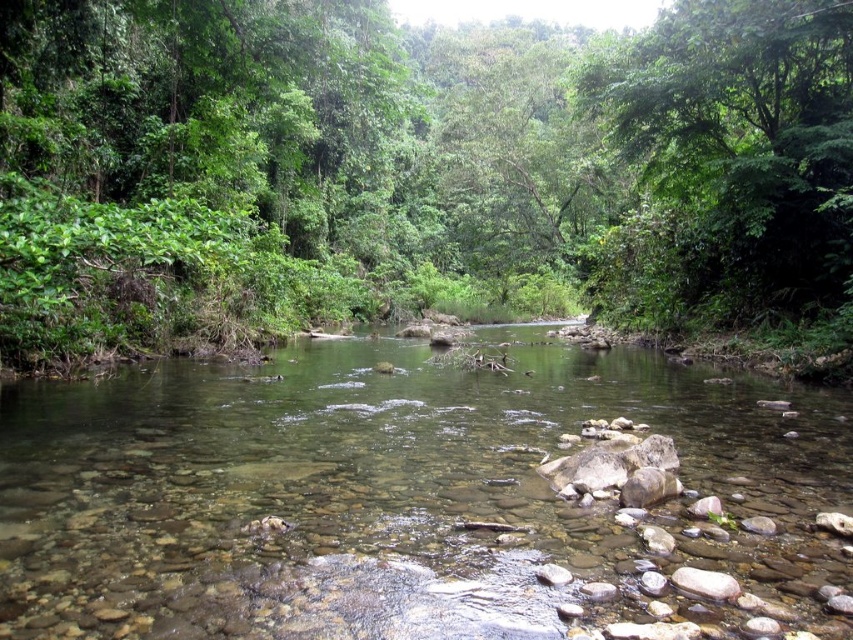
You are standing at the edge of the forest and want to cross the clear stone stream at center. There is a green leafy tree at upper center that you can use as a landmark. Which direction should you walk to reach the stream first before the tree becomes visible?

You should walk towards the clear stone stream at center because it is closer to you than the green leafy tree at upper center, so you will reach the stream before the tree comes into view.

You are standing at the edge of the river and want to determine which green leafy tree is taller. You see the green leafy tree at center and the green leafy tree at upper center. Which one is taller?

The green leafy tree at center is taller than the green leafy tree at upper center according to the description.